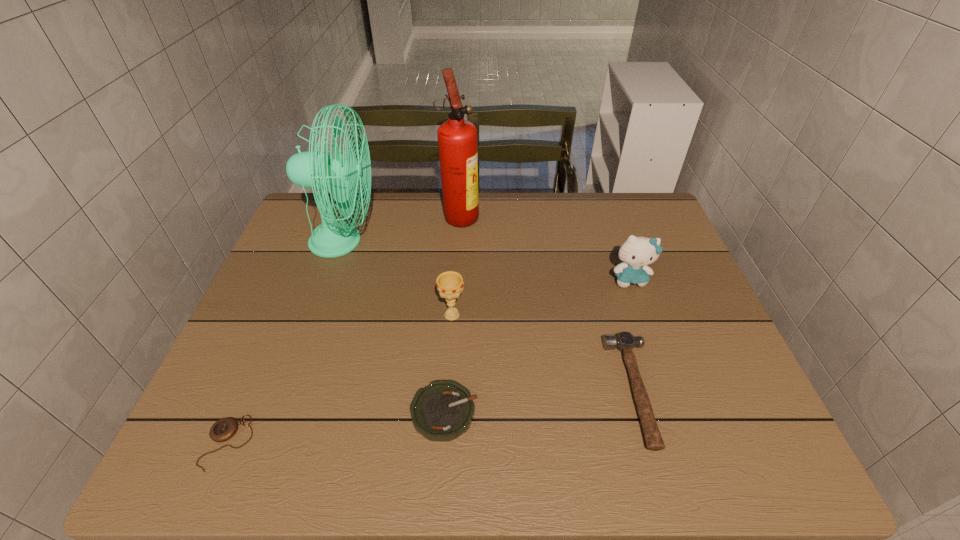
Where is `ashtray present at the near edge`? Image resolution: width=960 pixels, height=540 pixels. ashtray present at the near edge is located at coordinates (443, 410).

You are a GUI agent. You are given a task and a screenshot of the screen. Output one action in this format:
    pyautogui.click(x=<x>, y=<y>)
    Task: Click on the pocket watch that is at the near edge
    
    Given the screenshot: What is the action you would take?
    pyautogui.click(x=222, y=430)

Where is `fan that is at the left edge`? Image resolution: width=960 pixels, height=540 pixels. fan that is at the left edge is located at coordinates (314, 169).

Where is `pocket watch located in the left edge section of the desktop`? pocket watch located in the left edge section of the desktop is located at coordinates [x=222, y=430].

Where is `object that is at the right edge`? object that is at the right edge is located at coordinates (636, 253).

Find the location of a particular element. The image size is (960, 540). object that is at the far left corner is located at coordinates (314, 169).

Where is `object that is at the near left corner`? The image size is (960, 540). object that is at the near left corner is located at coordinates (222, 430).

In order to click on blank space at the far edge of the desktop in this screenshot , I will do `click(518, 208)`.

In order to click on vacant space at the near edge in this screenshot , I will do `click(279, 453)`.

At what (x,y) coordinates should I click in order to perform the action: click on free space at the left edge. Please return your answer as a coordinate pair (x, y). Image resolution: width=960 pixels, height=540 pixels. Looking at the image, I should click on (308, 300).